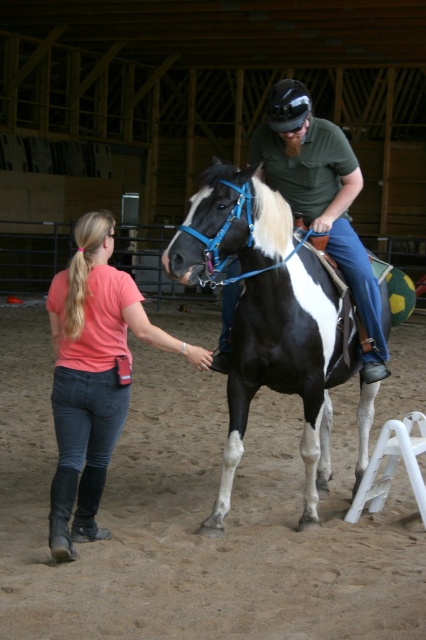
You are standing in the equestrian center and see the denim jeans at lower left and the matte green shirt at center. Which clothing item is positioned more to the left?

The denim jeans at lower left is positioned more to the left than the matte green shirt at center.